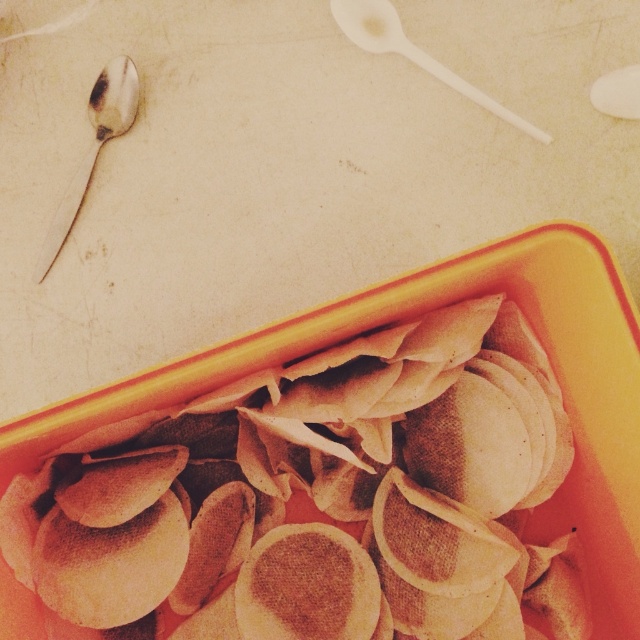
Looking at this image, which of these two, shiny silver spoon at upper left or white plastic spoon at upper center, stands taller?

Standing taller between the two is shiny silver spoon at upper left.

Looking at this image, does shiny silver spoon at upper left appear under white plastic spoon at upper center?

Yes.

Which is in front, point (45, 232) or point (435, 76)?

Point (45, 232) is in front.

Where is `shiny silver spoon at upper left`? The height and width of the screenshot is (640, 640). shiny silver spoon at upper left is located at coordinates (93, 147).

Who is positioned more to the right, brown matte dumplings at center or shiny silver spoon at upper left?

brown matte dumplings at center is more to the right.

Is brown matte dumplings at center shorter than shiny silver spoon at upper left?

No.

Locate an element on the screen. Image resolution: width=640 pixels, height=640 pixels. brown matte dumplings at center is located at coordinates coord(317,497).

Image resolution: width=640 pixels, height=640 pixels. I want to click on brown matte dumplings at center, so click(317, 497).

This screenshot has height=640, width=640. In order to click on brown matte dumplings at center in this screenshot , I will do tap(317, 497).

Can you confirm if brown matte dumplings at center is taller than white plastic spoon at upper center?

Yes.

Locate an element on the screen. brown matte dumplings at center is located at coordinates (317, 497).